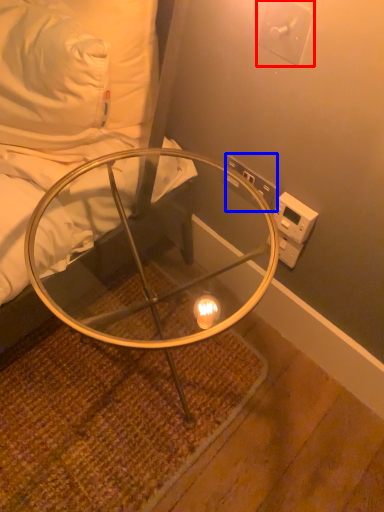
Question: Which object is closer to the camera taking this photo, electric outlet (highlighted by a red box) or electric outlet (highlighted by a blue box)?

Choices:
 (A) electric outlet
 (B) electric outlet

Answer: (A)